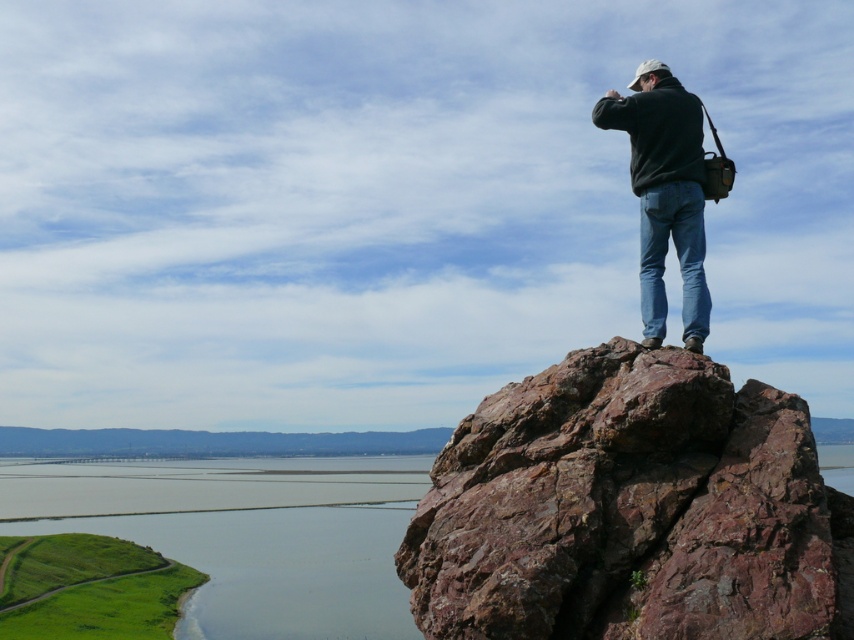
Does point (592, 465) come in front of point (706, 330)?

Yes, point (592, 465) is closer to viewer.

Is rusty rock at upper right thinner than black matte jacket at upper right?

No.

Is point (720, 467) farther from camera compared to point (641, 177)?

That is False.

The width and height of the screenshot is (854, 640). I want to click on rusty rock at upper right, so click(630, 509).